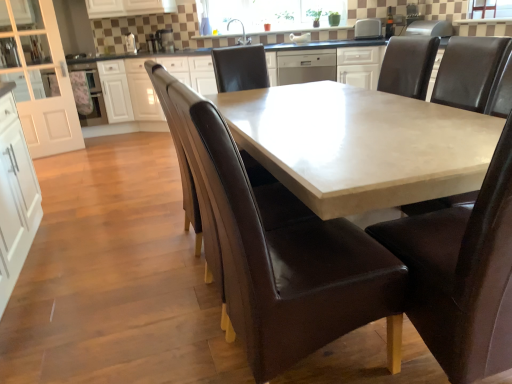
Question: Can you see brown leather armchair at center touching brown leather chair at center, acting as the 2th chair starting from the right?

Choices:
 (A) no
 (B) yes

Answer: (A)

Question: From a real-world perspective, is brown leather armchair at center positioned under brown leather chair at center, marked as the second chair in a left-to-right arrangement, based on gravity?

Choices:
 (A) no
 (B) yes

Answer: (A)

Question: Does brown leather armchair at center have a lesser height compared to brown leather chair at center, marked as the second chair in a left-to-right arrangement?

Choices:
 (A) no
 (B) yes

Answer: (A)

Question: From a real-world perspective, is brown leather armchair at center located higher than brown leather chair at center, acting as the 2th chair starting from the right?

Choices:
 (A) yes
 (B) no

Answer: (A)

Question: Does brown leather armchair at center have a lesser width compared to brown leather chair at center, acting as the 2th chair starting from the right?

Choices:
 (A) yes
 (B) no

Answer: (A)

Question: Is brown leather armchair at center in front of or behind white plastic toaster at upper center, marked as the 1th appliance in a right-to-left arrangement, in the image?

Choices:
 (A) behind
 (B) front

Answer: (B)

Question: From the image's perspective, is brown leather armchair at center located above or below white plastic toaster at upper center, marked as the 1th appliance in a right-to-left arrangement?

Choices:
 (A) below
 (B) above

Answer: (A)

Question: Considering the positions of point pos(214,271) and point pos(371,33), is point pos(214,271) closer or farther from the camera than point pos(371,33)?

Choices:
 (A) farther
 (B) closer

Answer: (B)

Question: Considering the relative positions of brown leather armchair at center and white plastic toaster at upper center, marked as the 1th appliance in a right-to-left arrangement, in the image provided, is brown leather armchair at center to the left or to the right of white plastic toaster at upper center, marked as the 1th appliance in a right-to-left arrangement,?

Choices:
 (A) left
 (B) right

Answer: (A)

Question: Considering the positions of white glossy cabinet at left, the second cabinetry viewed from the right, and brown leather chair at center, which appears as the 3th chair when viewed from the right, in the image, is white glossy cabinet at left, the second cabinetry viewed from the right, bigger or smaller than brown leather chair at center, which appears as the 3th chair when viewed from the right,?

Choices:
 (A) big
 (B) small

Answer: (B)

Question: Is white glossy cabinet at left, the second cabinetry viewed from the right, taller or shorter than brown leather chair at center, which appears as the 3th chair when viewed from the right?

Choices:
 (A) short
 (B) tall

Answer: (B)

Question: Is point (46, 130) positioned closer to the camera than point (286, 339)?

Choices:
 (A) farther
 (B) closer

Answer: (A)

Question: From the image's perspective, is white glossy cabinet at left, which appears as the first cabinetry when viewed from the left, positioned above or below brown leather chair at center, which appears as the 1th chair when viewed from the left?

Choices:
 (A) below
 (B) above

Answer: (B)

Question: Considering the positions of white glossy cabinet at center, which is the 2th cabinetry from left to right, and white plastic toaster at upper center, which ranks as the fourth appliance in left-to-right order, in the image, is white glossy cabinet at center, which is the 2th cabinetry from left to right, taller or shorter than white plastic toaster at upper center, which ranks as the fourth appliance in left-to-right order,?

Choices:
 (A) tall
 (B) short

Answer: (A)

Question: From a real-world perspective, is white glossy cabinet at center, which is the 2th cabinetry from left to right, positioned above or below white plastic toaster at upper center, marked as the 1th appliance in a right-to-left arrangement?

Choices:
 (A) above
 (B) below

Answer: (B)